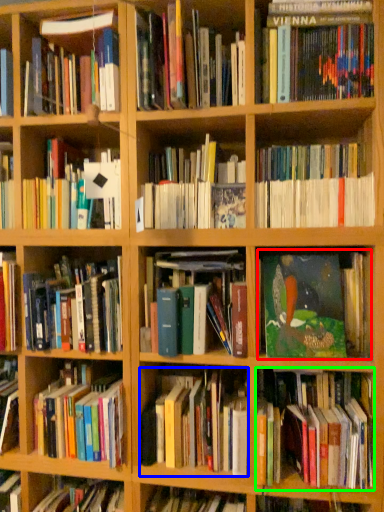
Question: Which is farther away from book (highlighted by a red box)? book (highlighted by a blue box) or book (highlighted by a green box)?

Choices:
 (A) book
 (B) book

Answer: (A)